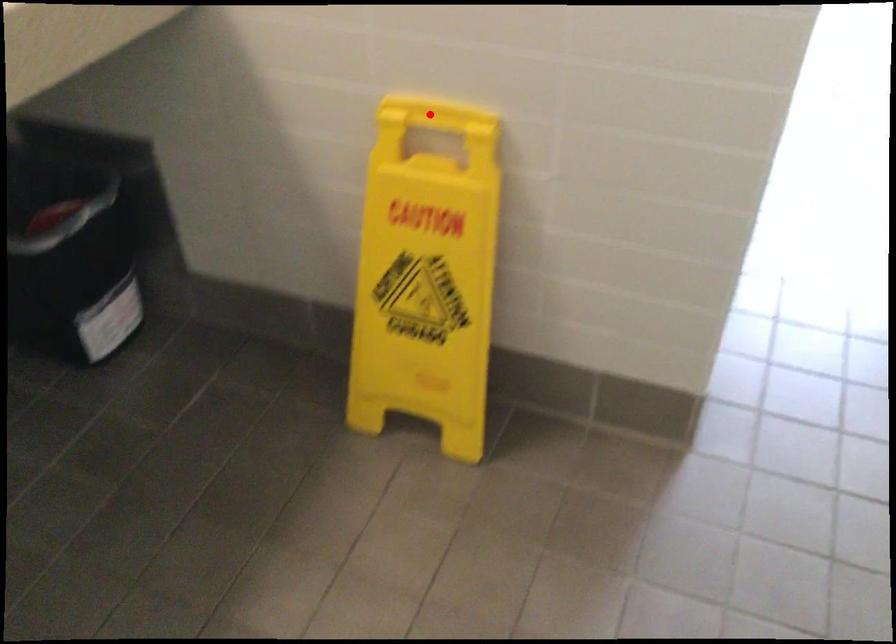
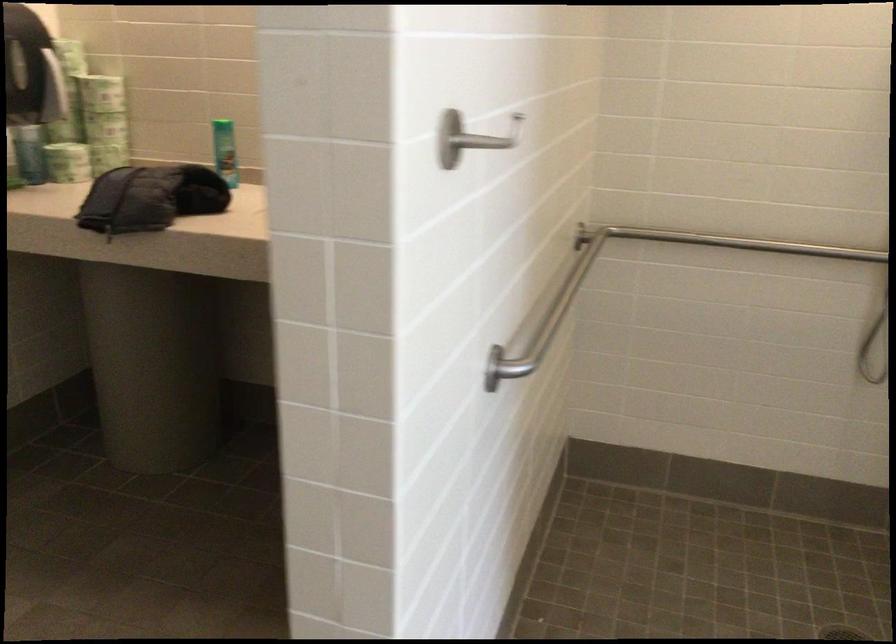
Question: I am providing you with two images of the same scene from different viewpoints. A red point is marked on the first image. Can you still see the location of the red point in image 2?

Choices:
 (A) Yes
 (B) No

Answer: (B)